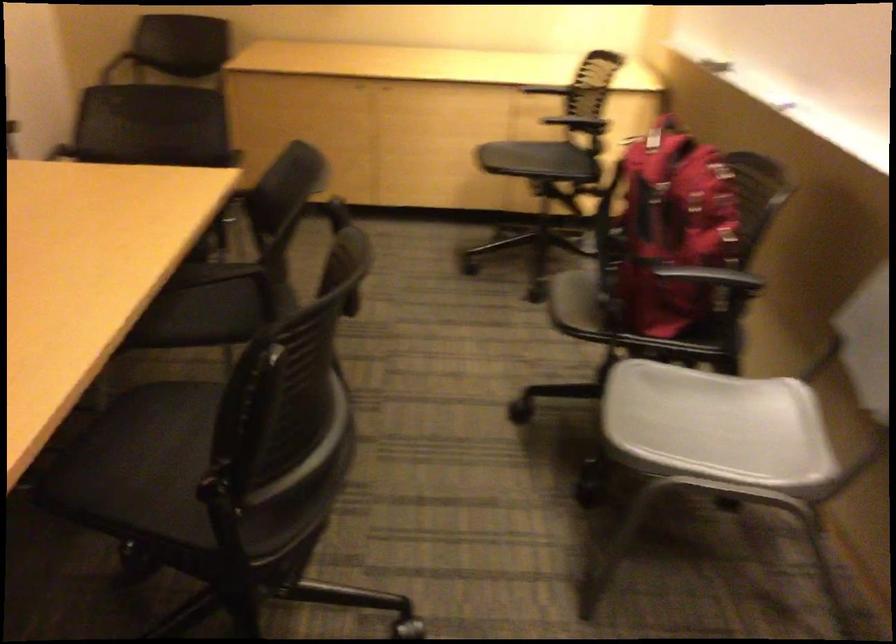
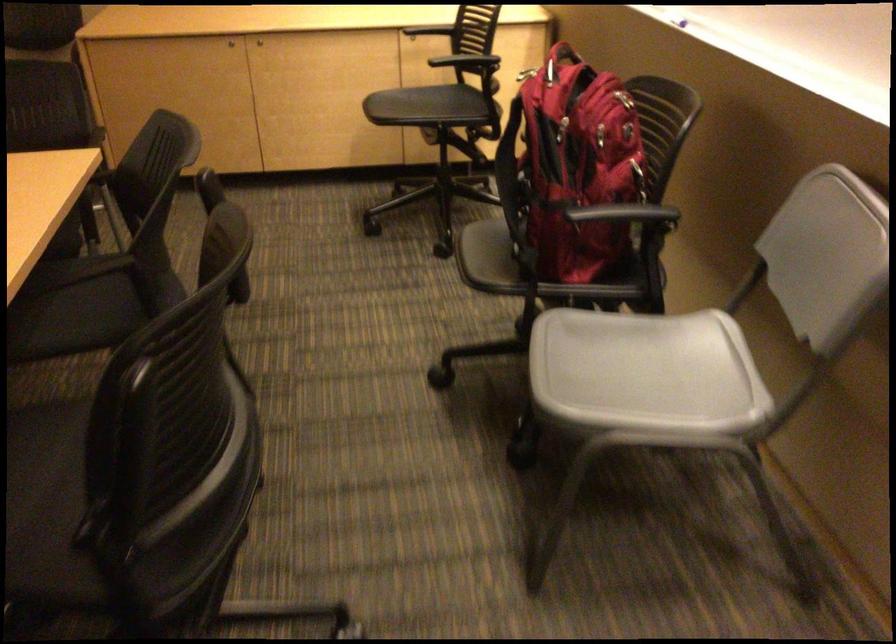
The point at [237,192] is marked in the first image. Where is the corresponding point in the second image?

(92, 178)